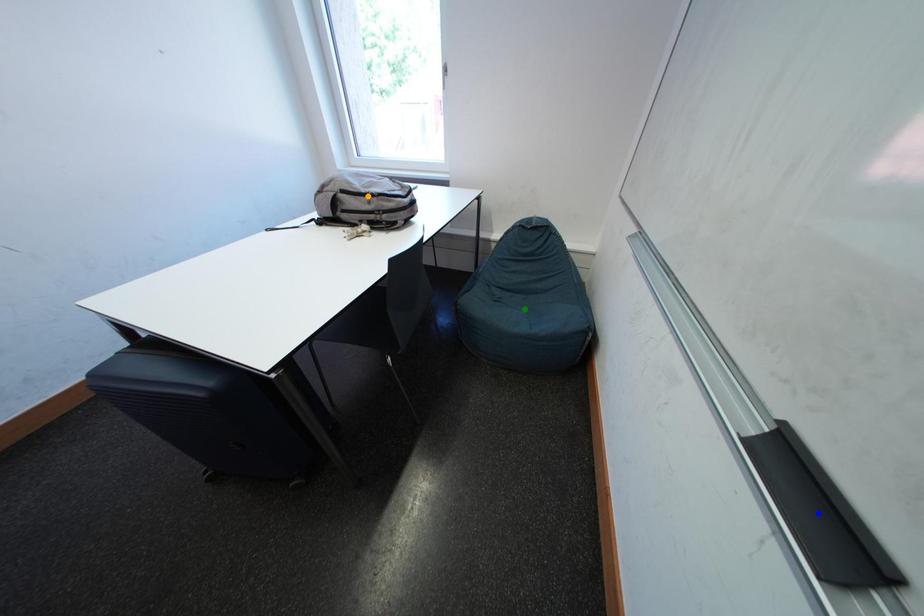
Order these from nearest to farthest:
blue point | orange point | green point

blue point → orange point → green point